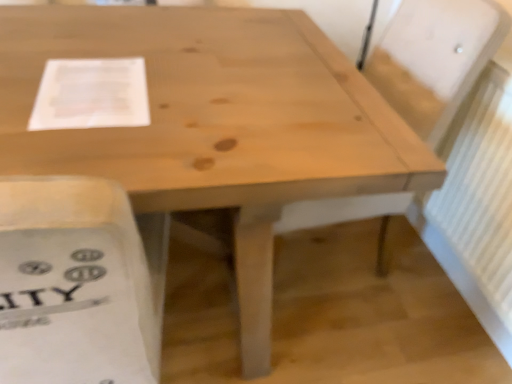
What are the coordinates of `white paper at upper left` in the screenshot? It's located at tap(91, 94).

What is the approximate height of white paper at upper left?

The height of white paper at upper left is 1.38 inches.

What do you see at coordinates (91, 94) in the screenshot? I see `white paper at upper left` at bounding box center [91, 94].

The height and width of the screenshot is (384, 512). Describe the element at coordinates (480, 188) in the screenshot. I see `white textured radiator at right` at that location.

Measure the distance between point (499, 246) and camera.

Point (499, 246) and camera are 1.24 meters apart.

Find the location of a particular element. white textured radiator at right is located at coordinates (480, 188).

Where is `white paper at upper left`? white paper at upper left is located at coordinates (91, 94).

Considering the positions of objects white paper at upper left and white textured radiator at right in the image provided, who is more to the right, white paper at upper left or white textured radiator at right?

white textured radiator at right.

Who is more distant, white paper at upper left or white textured radiator at right?

white textured radiator at right is behind.

Considering the points (47, 66) and (473, 221), which point is in front, point (47, 66) or point (473, 221)?

The point (47, 66) is in front.

From the image's perspective, is white paper at upper left over white textured radiator at right?

Yes, from the image's perspective, white paper at upper left is over white textured radiator at right.

From a real-world perspective, is white paper at upper left beneath white textured radiator at right?

No, from a real-world perspective, white paper at upper left is not beneath white textured radiator at right.

Is white paper at upper left thinner than white textured radiator at right?

No.

Considering the relative sizes of white paper at upper left and white textured radiator at right in the image provided, is white paper at upper left shorter than white textured radiator at right?

Indeed, white paper at upper left has a lesser height compared to white textured radiator at right.

Is white paper at upper left bigger or smaller than white textured radiator at right?

In the image, white paper at upper left appears to be smaller than white textured radiator at right.

From the picture: Is white paper at upper left not inside white textured radiator at right?

Indeed, white paper at upper left is completely outside white textured radiator at right.

Is white paper at upper left directly adjacent to white textured radiator at right?

No, white paper at upper left is not next to white textured radiator at right.

Is white paper at upper left oriented towards white textured radiator at right?

No, white paper at upper left is not aimed at white textured radiator at right.

Can you tell me how much white paper at upper left and white textured radiator at right differ in facing direction?

The angular difference between white paper at upper left and white textured radiator at right is 86.6 degrees.

You are a GUI agent. You are given a task and a screenshot of the screen. Output one action in this format:
    pyautogui.click(x=<x>, y=<y>)
    Task: Click on the paper located on the left of white textured radiator at right
    The width and height of the screenshot is (512, 384).
    Given the screenshot: What is the action you would take?
    pyautogui.click(x=91, y=94)

Considering the relative positions of white textured radiator at right and white paper at upper left in the image provided, is white textured radiator at right to the left or to the right of white paper at upper left?

white textured radiator at right is to the right of white paper at upper left.

Between white textured radiator at right and white paper at upper left, which one is positioned in front?

Positioned in front is white paper at upper left.

Does point (501, 142) lie behind point (123, 100)?

Yes, it is.

From the image's perspective, which one is positioned lower, white textured radiator at right or white paper at upper left?

white textured radiator at right is shown below in the image.

From a real-world perspective, which object stands above the other?

white paper at upper left, from a real-world perspective.

Can you confirm if white textured radiator at right is wider than white paper at upper left?

No.

Considering the sizes of objects white textured radiator at right and white paper at upper left in the image provided, who is shorter, white textured radiator at right or white paper at upper left?

Standing shorter between the two is white paper at upper left.

Can you confirm if white textured radiator at right is smaller than white paper at upper left?

No.

Is white paper at upper left inside white textured radiator at right?

No.

Is white textured radiator at right far from white paper at upper left?

Indeed, white textured radiator at right is not near white paper at upper left.

Is white textured radiator at right facing towards white paper at upper left?

Yes, white textured radiator at right is aimed at white paper at upper left.

From the picture: How many degrees apart are the facing directions of white textured radiator at right and white paper at upper left?

The facing directions of white textured radiator at right and white paper at upper left are 86.6 degrees apart.

Image resolution: width=512 pixels, height=384 pixels. I want to click on radiator located on the right of white paper at upper left, so click(x=480, y=188).

Find the location of a particular element. This screenshot has width=512, height=384. radiator located on the right of white paper at upper left is located at coordinates (480, 188).

The image size is (512, 384). Identify the location of paper above the white textured radiator at right (from the image's perspective). (91, 94).